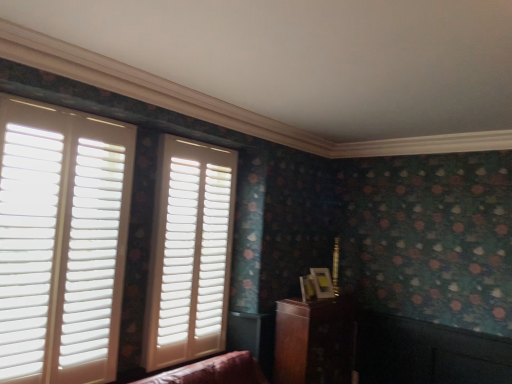
The height and width of the screenshot is (384, 512). What do you see at coordinates (61, 242) in the screenshot?
I see `white matte shutters at left, placed as the 2th window when sorted from right to left` at bounding box center [61, 242].

Find the location of `white matte shutters at center, positioned as the second window in left-to-right order`. white matte shutters at center, positioned as the second window in left-to-right order is located at coordinates (189, 253).

Locate an element on the screen. Image resolution: width=512 pixels, height=384 pixels. wooden cabinet at lower right is located at coordinates (315, 341).

Is white matte shutters at center, which is counted as the first window, starting from the right, wider than white matte shutters at left, placed as the first window when sorted from front to back?

No, white matte shutters at center, which is counted as the first window, starting from the right, is not wider than white matte shutters at left, placed as the first window when sorted from front to back.

Is point (181, 249) closer to camera compared to point (29, 254)?

No, (181, 249) is further to viewer.

What's the angular difference between white matte shutters at center, arranged as the 2th window when viewed from the front, and white matte shutters at left, placed as the first window when sorted from front to back,'s facing directions?

There is a 0.00166-degree angle between the facing directions of white matte shutters at center, arranged as the 2th window when viewed from the front, and white matte shutters at left, placed as the first window when sorted from front to back.

Find the location of a particular element. window that is above the white matte shutters at center, which is counted as the first window, starting from the right (from the image's perspective) is located at coordinates (61, 242).

Which is less distant, [191,309] or [351,339]?

The point [191,309] is closer.

Does white matte shutters at center, positioned as the second window in left-to-right order, come in front of wooden cabinet at lower right?

Yes, it is.

From the image's perspective, is white matte shutters at center, which appears as the 1th window when viewed from the back, located above wooden cabinet at lower right?

Yes, from the image's perspective, white matte shutters at center, which appears as the 1th window when viewed from the back, is on top of wooden cabinet at lower right.

Does white matte shutters at center, which is counted as the first window, starting from the right, have a greater height compared to wooden cabinet at lower right?

Yes, white matte shutters at center, which is counted as the first window, starting from the right, is taller than wooden cabinet at lower right.

Find the location of a particular element. furniture that appears below the white matte shutters at center, positioned as the second window in left-to-right order (from the image's perspective) is located at coordinates (315, 341).

Between point (317, 327) and point (229, 213), which one is positioned in front?

The point (317, 327) is more forward.

Does wooden cabinet at lower right contain white matte shutters at center, which is counted as the first window, starting from the right?

No, white matte shutters at center, which is counted as the first window, starting from the right, is not inside wooden cabinet at lower right.

Considering the relative sizes of wooden cabinet at lower right and white matte shutters at center, arranged as the 2th window when viewed from the front, in the image provided, is wooden cabinet at lower right wider than white matte shutters at center, arranged as the 2th window when viewed from the front,?

Yes, wooden cabinet at lower right is wider than white matte shutters at center, arranged as the 2th window when viewed from the front.

In the scene shown: Is white matte shutters at center, which appears as the 1th window when viewed from the back, surrounded by white matte shutters at left, placed as the 2th window when sorted from back to front?

Definitely not — white matte shutters at center, which appears as the 1th window when viewed from the back, is not inside white matte shutters at left, placed as the 2th window when sorted from back to front.

Is white matte shutters at left, placed as the 2th window when sorted from back to front, far from white matte shutters at center, which is counted as the first window, starting from the right?

That's not correct — white matte shutters at left, placed as the 2th window when sorted from back to front, is a little close to white matte shutters at center, which is counted as the first window, starting from the right.

Considering the relative sizes of white matte shutters at left, placed as the 2th window when sorted from back to front, and white matte shutters at center, which appears as the 1th window when viewed from the back, in the image provided, is white matte shutters at left, placed as the 2th window when sorted from back to front, shorter than white matte shutters at center, which appears as the 1th window when viewed from the back,?

Correct, white matte shutters at left, placed as the 2th window when sorted from back to front, is not as tall as white matte shutters at center, which appears as the 1th window when viewed from the back.

Is white matte shutters at left, placed as the 2th window when sorted from right to left, aimed at white matte shutters at center, arranged as the 2th window when viewed from the front?

No, white matte shutters at left, placed as the 2th window when sorted from right to left, does not turn towards white matte shutters at center, arranged as the 2th window when viewed from the front.

What are the coordinates of `furniture behind the white matte shutters at left, placed as the 2th window when sorted from back to front` in the screenshot? It's located at (315, 341).

Does white matte shutters at left, the 1th window in the left-to-right sequence, have a larger size compared to wooden cabinet at lower right?

Correct, white matte shutters at left, the 1th window in the left-to-right sequence, is larger in size than wooden cabinet at lower right.

Looking at this image, could wooden cabinet at lower right be considered to be inside white matte shutters at left, placed as the 2th window when sorted from back to front?

No.

Is the depth of wooden cabinet at lower right greater than that of white matte shutters at left, placed as the 2th window when sorted from right to left?

Yes.

From a real-world perspective, between wooden cabinet at lower right and white matte shutters at left, placed as the 2th window when sorted from right to left, who is vertically lower?

From a 3D spatial view, wooden cabinet at lower right is below.

Is wooden cabinet at lower right completely or partially outside of white matte shutters at left, placed as the 2th window when sorted from back to front?

That's correct, wooden cabinet at lower right is outside of white matte shutters at left, placed as the 2th window when sorted from back to front.

Is wooden cabinet at lower right looking in the opposite direction of white matte shutters at left, placed as the 2th window when sorted from back to front?

No, wooden cabinet at lower right's orientation is not away from white matte shutters at left, placed as the 2th window when sorted from back to front.

Identify the location of window beneath the white matte shutters at left, placed as the 2th window when sorted from back to front (from a real-world perspective). This screenshot has width=512, height=384. (189, 253).

The height and width of the screenshot is (384, 512). I want to click on the 1st window positioned above the wooden cabinet at lower right (from a real-world perspective), so click(x=189, y=253).

Based on their spatial positions, is white matte shutters at center, which appears as the 1th window when viewed from the back, or wooden cabinet at lower right further from white matte shutters at left, placed as the 2th window when sorted from back to front?

wooden cabinet at lower right lies further to white matte shutters at left, placed as the 2th window when sorted from back to front, than the other object.

When comparing their distances from white matte shutters at left, placed as the 2th window when sorted from back to front, does wooden cabinet at lower right or white matte shutters at center, which is counted as the first window, starting from the right, seem closer?

white matte shutters at center, which is counted as the first window, starting from the right, is positioned closer to the anchor white matte shutters at left, placed as the 2th window when sorted from back to front.

Which object lies nearer to the anchor point wooden cabinet at lower right, white matte shutters at left, placed as the first window when sorted from front to back, or white matte shutters at center, which is counted as the first window, starting from the right?

white matte shutters at center, which is counted as the first window, starting from the right.

Which object lies further to the anchor point wooden cabinet at lower right, white matte shutters at center, positioned as the second window in left-to-right order, or white matte shutters at left, placed as the first window when sorted from front to back?

white matte shutters at left, placed as the first window when sorted from front to back, is further to wooden cabinet at lower right.

Considering their positions, is wooden cabinet at lower right positioned closer to white matte shutters at center, positioned as the second window in left-to-right order, than white matte shutters at left, placed as the 2th window when sorted from right to left?

Based on the image, white matte shutters at left, placed as the 2th window when sorted from right to left, appears to be nearer to white matte shutters at center, positioned as the second window in left-to-right order.

Based on their spatial positions, is white matte shutters at left, placed as the 2th window when sorted from right to left, or wooden cabinet at lower right closer to white matte shutters at center, positioned as the second window in left-to-right order?

white matte shutters at left, placed as the 2th window when sorted from right to left, lies closer to white matte shutters at center, positioned as the second window in left-to-right order, than the other object.

Image resolution: width=512 pixels, height=384 pixels. Find the location of `window located between white matte shutters at left, placed as the first window when sorted from front to back, and wooden cabinet at lower right in the left-right direction`. window located between white matte shutters at left, placed as the first window when sorted from front to back, and wooden cabinet at lower right in the left-right direction is located at coordinates pyautogui.click(x=189, y=253).